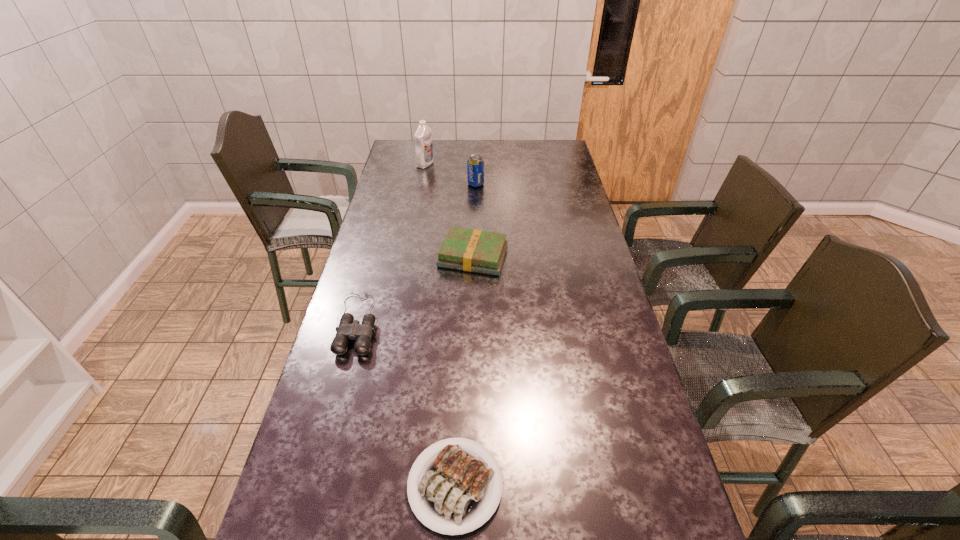
Identify the location of vacant point located between the binoculars and the fourth shortest object. (417, 253).

Where is `free space between the book and the fourth object from right to left`? free space between the book and the fourth object from right to left is located at coordinates (449, 211).

Locate an element on the screen. blank region between the binoculars and the second farthest object is located at coordinates (x=417, y=253).

Where is `free space between the fourth farthest object and the tallest object`? The height and width of the screenshot is (540, 960). free space between the fourth farthest object and the tallest object is located at coordinates pos(392,244).

Find the location of a particular element. This screenshot has width=960, height=540. vacant area that lies between the third nearest object and the fourth tallest object is located at coordinates (416, 290).

At what (x,y) coordinates should I click in order to perform the action: click on free spot between the book and the detergent. Please return your answer as a coordinate pair (x, y). Looking at the image, I should click on (449, 211).

Choose which object is the fourth nearest neighbor to the farthest object. Please provide its 2D coordinates. Your answer should be formatted as a tuple, i.e. [(x, y)], where the tuple contains the x and y coordinates of a point satisfying the conditions above.

[(454, 490)]

Locate which object is the second closest to the third shortest object. Please provide its 2D coordinates. Your answer should be formatted as a tuple, i.e. [(x, y)], where the tuple contains the x and y coordinates of a point satisfying the conditions above.

[(475, 165)]